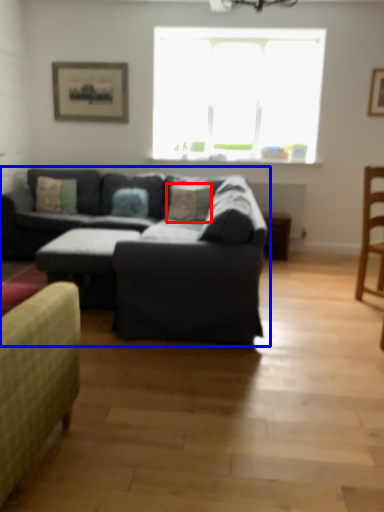
Question: Which object appears farthest to the camera in this image, pillow (highlighted by a red box) or studio couch (highlighted by a blue box)?

Choices:
 (A) pillow
 (B) studio couch

Answer: (A)